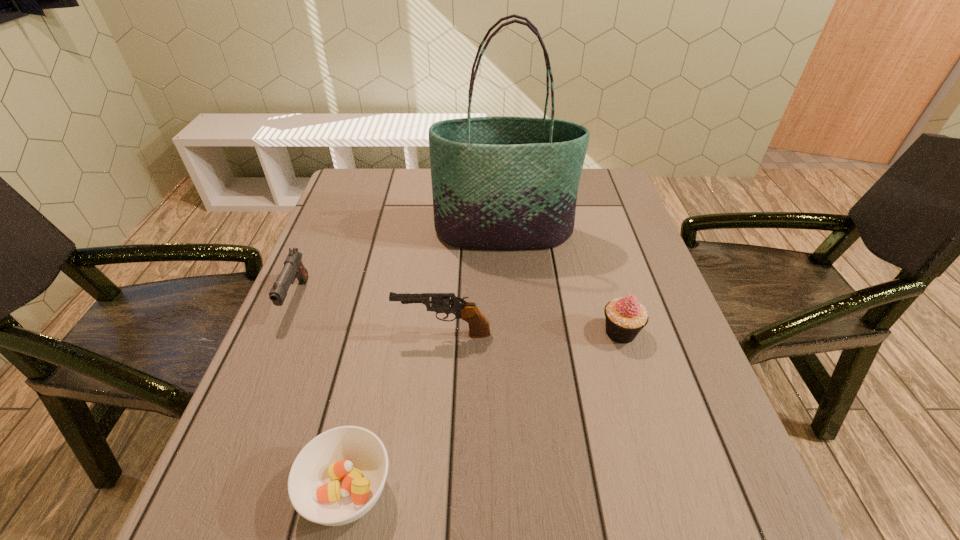
Identify the location of free space between the shorter gun and the right gun. Image resolution: width=960 pixels, height=540 pixels. (370, 316).

I want to click on vacant space that's between the rightmost object and the nearer gun, so click(532, 333).

The width and height of the screenshot is (960, 540). I want to click on vacant area between the nearer gun and the cupcake, so click(532, 333).

Find the location of a particular element. This screenshot has height=540, width=960. empty space that is in between the nearer gun and the tallest object is located at coordinates (473, 284).

You are a GUI agent. You are given a task and a screenshot of the screen. Output one action in this format:
    pyautogui.click(x=<x>, y=<y>)
    Task: Click on the unoccupied position between the leftmost object and the tallest object
    This screenshot has width=960, height=540.
    Given the screenshot: What is the action you would take?
    pyautogui.click(x=400, y=266)

At what (x,y) coordinates should I click in order to perform the action: click on free space between the rightmost object and the nearer gun. Please return your answer as a coordinate pair (x, y). The image size is (960, 540). Looking at the image, I should click on (532, 333).

Where is `object that is the third closest to the shortest object`? This screenshot has width=960, height=540. object that is the third closest to the shortest object is located at coordinates (625, 317).

Where is `object that is the closest to the shorter gun`? object that is the closest to the shorter gun is located at coordinates (479, 327).

The width and height of the screenshot is (960, 540). I want to click on free region that satisfies the following two spatial constraints: 1. along the barrel of the taller gun; 2. in the direction the shorter gun is aimed, so click(446, 298).

You are a GUI agent. You are given a task and a screenshot of the screen. Output one action in this format:
    pyautogui.click(x=<x>, y=<y>)
    Task: Click on the free region that satisfies the following two spatial constraints: 1. along the barrel of the taller gun; 2. in the direction the shorter gun is aimed
    The width and height of the screenshot is (960, 540).
    Given the screenshot: What is the action you would take?
    pyautogui.click(x=446, y=298)